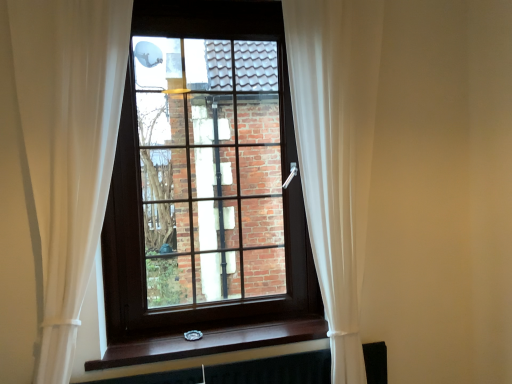
Question: Does brown wooden window at center have a smaller size compared to brown wood at lower center?

Choices:
 (A) yes
 (B) no

Answer: (B)

Question: From a real-world perspective, is brown wooden window at center beneath brown wood at lower center?

Choices:
 (A) no
 (B) yes

Answer: (A)

Question: Is brown wooden window at center turned away from brown wood at lower center?

Choices:
 (A) no
 (B) yes

Answer: (A)

Question: Could you tell me if brown wooden window at center is turned towards brown wood at lower center?

Choices:
 (A) yes
 (B) no

Answer: (B)

Question: From a real-world perspective, is brown wooden window at center physically above brown wood at lower center?

Choices:
 (A) no
 (B) yes

Answer: (B)

Question: From the image's perspective, is brown wooden window at center on top of brown wood at lower center?

Choices:
 (A) no
 (B) yes

Answer: (B)

Question: Considering the relative sizes of brown wooden window at center and white sheer curtain at right, placed as the 1th curtain when sorted from right to left, in the image provided, is brown wooden window at center thinner than white sheer curtain at right, placed as the 1th curtain when sorted from right to left,?

Choices:
 (A) yes
 (B) no

Answer: (A)

Question: Is white sheer curtain at right, the second curtain positioned from the left, inside brown wooden window at center?

Choices:
 (A) no
 (B) yes

Answer: (A)

Question: Is brown wooden window at center located outside white sheer curtain at right, placed as the 1th curtain when sorted from right to left?

Choices:
 (A) yes
 (B) no

Answer: (A)

Question: Is brown wooden window at center further to the viewer compared to white sheer curtain at right, placed as the 1th curtain when sorted from right to left?

Choices:
 (A) no
 (B) yes

Answer: (B)

Question: Is brown wooden window at center aimed at white sheer curtain at right, the second curtain positioned from the left?

Choices:
 (A) yes
 (B) no

Answer: (B)

Question: Is brown wooden window at center in front of white sheer curtain at right, placed as the 1th curtain when sorted from right to left?

Choices:
 (A) no
 (B) yes

Answer: (A)

Question: Are white sheer curtain at center, acting as the first curtain starting from the left, and black matte radiator at bottom far apart?

Choices:
 (A) yes
 (B) no

Answer: (B)